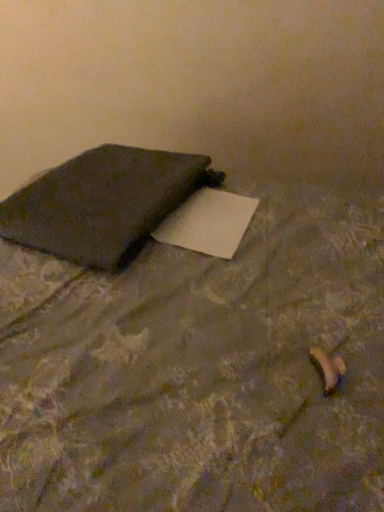
Where is `matte black notebook at left`? matte black notebook at left is located at coordinates (103, 203).

The height and width of the screenshot is (512, 384). What do you see at coordinates (103, 203) in the screenshot? I see `matte black notebook at left` at bounding box center [103, 203].

I want to click on matte black pillow at upper left, so click(x=187, y=349).

Image resolution: width=384 pixels, height=512 pixels. What do you see at coordinates (187, 349) in the screenshot?
I see `matte black pillow at upper left` at bounding box center [187, 349].

Where is `matte black notebook at left`? matte black notebook at left is located at coordinates (103, 203).

Considering the relative positions of matte black notebook at left and matte black pillow at upper left in the image provided, is matte black notebook at left to the right of matte black pillow at upper left from the viewer's perspective?

In fact, matte black notebook at left is to the left of matte black pillow at upper left.

Does matte black notebook at left lie in front of matte black pillow at upper left?

No, it is not.

Is point (120, 188) positioned in front of point (87, 234)?

No, it is behind (87, 234).

From the image's perspective, would you say matte black notebook at left is positioned over matte black pillow at upper left?

Yes, from the image's perspective, matte black notebook at left is above matte black pillow at upper left.

From a real-world perspective, who is located higher, matte black notebook at left or matte black pillow at upper left?

matte black notebook at left is physically above.

Looking at their sizes, would you say matte black notebook at left is wider or thinner than matte black pillow at upper left?

In the image, matte black notebook at left appears to be more narrow than matte black pillow at upper left.

Who is taller, matte black notebook at left or matte black pillow at upper left?

Standing taller between the two is matte black pillow at upper left.

Considering the relative sizes of matte black notebook at left and matte black pillow at upper left in the image provided, is matte black notebook at left smaller than matte black pillow at upper left?

Yes, matte black notebook at left is smaller than matte black pillow at upper left.

Can matte black pillow at upper left be found inside matte black notebook at left?

No, matte black notebook at left does not contain matte black pillow at upper left.

Is matte black notebook at left not close to matte black pillow at upper left?

They are positioned close to each other.

Based on the photo, could you tell me if matte black notebook at left is facing matte black pillow at upper left?

Yes, matte black notebook at left faces towards matte black pillow at upper left.

The image size is (384, 512). Identify the location of furniture in front of the matte black notebook at left. (187, 349).

Considering the relative positions of matte black pillow at upper left and matte black notebook at left in the image provided, is matte black pillow at upper left to the left or to the right of matte black notebook at left?

Based on their positions, matte black pillow at upper left is located to the right of matte black notebook at left.

Which is behind, matte black pillow at upper left or matte black notebook at left?

matte black notebook at left is more distant.

Is point (37, 239) in front of point (104, 195)?

Yes, it is.

From the image's perspective, which is above, matte black pillow at upper left or matte black notebook at left?

From the image's view, matte black notebook at left is above.

From a real-world perspective, does matte black pillow at upper left stand above matte black notebook at left?

No.

Between matte black pillow at upper left and matte black notebook at left, which one has larger width?

matte black pillow at upper left is wider.

Considering the sizes of matte black pillow at upper left and matte black notebook at left in the image, is matte black pillow at upper left taller or shorter than matte black notebook at left?

In the image, matte black pillow at upper left appears to be taller than matte black notebook at left.

Based on their sizes in the image, would you say matte black pillow at upper left is bigger or smaller than matte black notebook at left?

matte black pillow at upper left is bigger than matte black notebook at left.

Is matte black pillow at upper left spatially inside matte black notebook at left, or outside of it?

matte black pillow at upper left is not inside matte black notebook at left, it's outside.

Would you say matte black pillow at upper left is a long distance from matte black notebook at left?

Result: They are positioned close to each other.

Is matte black pillow at upper left looking in the opposite direction of matte black notebook at left?

Yes, matte black pillow at upper left is facing away from matte black notebook at left.

Can you tell me how much matte black pillow at upper left and matte black notebook at left differ in facing direction?

There is a 17.1-degree angle between the facing directions of matte black pillow at upper left and matte black notebook at left.

This screenshot has height=512, width=384. What are the coordinates of `furniture below the matte black notebook at left (from the image's perspective)` in the screenshot? It's located at (187, 349).

The height and width of the screenshot is (512, 384). I want to click on furniture to the right of matte black notebook at left, so click(187, 349).

Where is `notebook on the left of matte black pillow at upper left`? notebook on the left of matte black pillow at upper left is located at coordinates (103, 203).